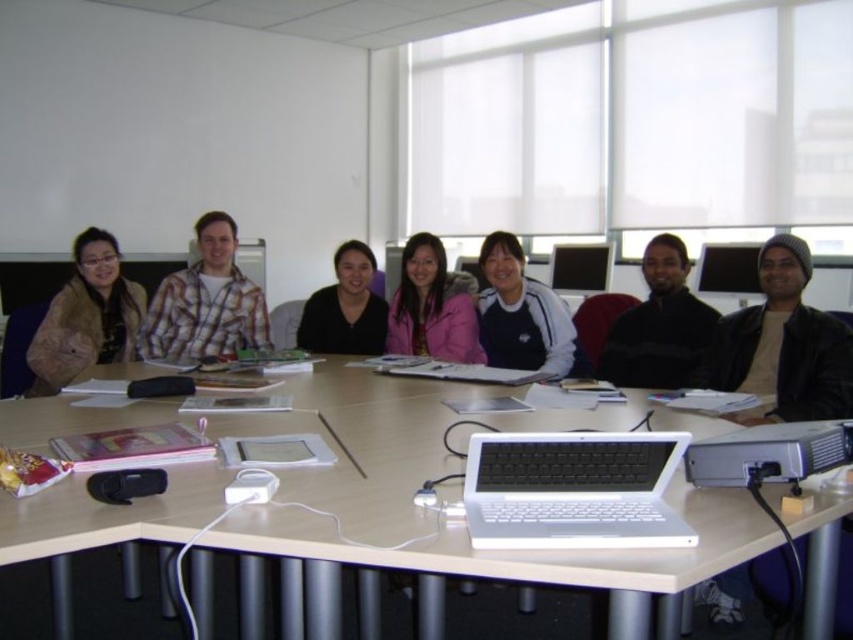
Does plaid shirt at center have a smaller size compared to black matte shirt at center?

No, plaid shirt at center is not smaller than black matte shirt at center.

What do you see at coordinates (206, 301) in the screenshot? This screenshot has width=853, height=640. I see `plaid shirt at center` at bounding box center [206, 301].

Find the location of `plaid shirt at center`. plaid shirt at center is located at coordinates (206, 301).

Can you confirm if white plastic table at center is positioned above pink fleece jacket at center?

Incorrect, white plastic table at center is not positioned above pink fleece jacket at center.

Can you confirm if white plastic table at center is positioned to the right of pink fleece jacket at center?

In fact, white plastic table at center is to the left of pink fleece jacket at center.

What are the coordinates of `white plastic table at center` in the screenshot? It's located at (436, 513).

At what (x,y) coordinates should I click in order to perform the action: click on white plastic table at center. Please return your answer as a coordinate pair (x, y). This screenshot has width=853, height=640. Looking at the image, I should click on (436, 513).

Which is more to the left, matte brown jacket at left or black matte shirt at center?

matte brown jacket at left

Can you confirm if matte brown jacket at left is thinner than black matte shirt at center?

Correct, matte brown jacket at left's width is less than black matte shirt at center's.

Describe the element at coordinates (86, 316) in the screenshot. I see `matte brown jacket at left` at that location.

The image size is (853, 640). Find the location of `matte brown jacket at left`. matte brown jacket at left is located at coordinates (86, 316).